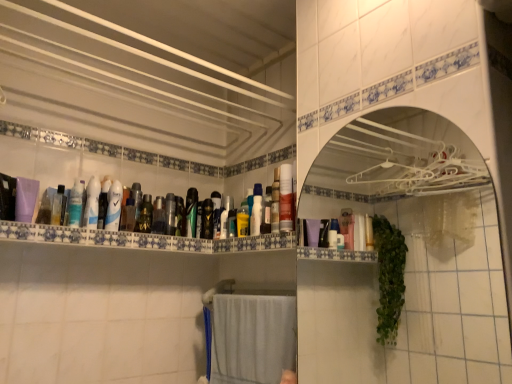
Describe the element at coordinates (252, 338) in the screenshot. Image resolution: width=512 pixels, height=384 pixels. I see `white fabric bath towel at lower center` at that location.

Measure the distance between point (33, 233) and camera.

Point (33, 233) is 4.55 feet away from camera.

What do you see at coordinates (207, 219) in the screenshot? I see `metallic green mouthwash at center, the fourth mouthwash when ordered from right to left` at bounding box center [207, 219].

What do you see at coordinates (286, 199) in the screenshot?
I see `matte plastic mouthwash at center, the first mouthwash viewed from the right` at bounding box center [286, 199].

How much space does green matte bottle at center, which appears as the 6th mouthwash when viewed from the left, occupy vertically?

green matte bottle at center, which appears as the 6th mouthwash when viewed from the left, is 6.80 inches tall.

Identify the location of white fabric bath towel at lower center. (252, 338).

Is blue glossy mouthwash at upper left, which is the thirteenth mouthwash in right-to-left order, outside of metallic green mouthwash at center, marked as the 11th mouthwash in a left-to-right arrangement?

blue glossy mouthwash at upper left, which is the thirteenth mouthwash in right-to-left order, is positioned outside metallic green mouthwash at center, marked as the 11th mouthwash in a left-to-right arrangement.

Considering the relative sizes of blue glossy mouthwash at upper left, which is the thirteenth mouthwash in right-to-left order, and metallic green mouthwash at center, the fourth mouthwash when ordered from right to left, in the image provided, is blue glossy mouthwash at upper left, which is the thirteenth mouthwash in right-to-left order, smaller than metallic green mouthwash at center, the fourth mouthwash when ordered from right to left,?

No.

Which is nearer, (83, 194) or (206, 224)?

Positioned in front is point (83, 194).

Considering the sizes of objects blue glossy mouthwash at upper left, placed as the second mouthwash when sorted from left to right, and metallic green mouthwash at center, the fourth mouthwash when ordered from right to left, in the image provided, who is wider, blue glossy mouthwash at upper left, placed as the second mouthwash when sorted from left to right, or metallic green mouthwash at center, the fourth mouthwash when ordered from right to left,?

metallic green mouthwash at center, the fourth mouthwash when ordered from right to left.

Can you confirm if metallic green mouthwash at center, marked as the 11th mouthwash in a left-to-right arrangement, is bigger than green matte bottle at center, which appears as the 6th mouthwash when viewed from the left?

Incorrect, metallic green mouthwash at center, marked as the 11th mouthwash in a left-to-right arrangement, is not larger than green matte bottle at center, which appears as the 6th mouthwash when viewed from the left.

Is point (201, 220) positioned before point (140, 210)?

No.

In the scene shown: Between metallic green mouthwash at center, marked as the 11th mouthwash in a left-to-right arrangement, and green matte bottle at center, which appears as the 6th mouthwash when viewed from the left, which one has less height?

Standing shorter between the two is metallic green mouthwash at center, marked as the 11th mouthwash in a left-to-right arrangement.

From the image's perspective, is metallic green mouthwash at center, marked as the 11th mouthwash in a left-to-right arrangement, located above or below green matte bottle at center, which appears as the 6th mouthwash when viewed from the left?

Clearly, from the image's perspective, metallic green mouthwash at center, marked as the 11th mouthwash in a left-to-right arrangement, is below green matte bottle at center, which appears as the 6th mouthwash when viewed from the left.

From the image's perspective, is translucent plastic mouthwash at center, which is the fifth mouthwash in left-to-right order, over white fabric bath towel at lower center?

Yes.

Does translucent plastic mouthwash at center, which is the fifth mouthwash in left-to-right order, contain white fabric bath towel at lower center?

No, white fabric bath towel at lower center is not inside translucent plastic mouthwash at center, which is the fifth mouthwash in left-to-right order.

Is translucent plastic mouthwash at center, which is the fifth mouthwash in left-to-right order, placed right next to white fabric bath towel at lower center?

No.

Which is correct: translucent plastic mouthwash at center, which is the fifth mouthwash in left-to-right order, is inside matte plastic mouthwash at center, the first mouthwash viewed from the right, or outside of it?

translucent plastic mouthwash at center, which is the fifth mouthwash in left-to-right order, cannot be found inside matte plastic mouthwash at center, the first mouthwash viewed from the right.

Which of these two, translucent plastic mouthwash at center, arranged as the tenth mouthwash when viewed from the right, or matte plastic mouthwash at center, the 14th mouthwash positioned from the left, stands taller?

matte plastic mouthwash at center, the 14th mouthwash positioned from the left, is taller.

Is matte plastic mouthwash at center, the first mouthwash viewed from the right, at the back of translucent plastic mouthwash at center, arranged as the tenth mouthwash when viewed from the right?

That's not correct — translucent plastic mouthwash at center, arranged as the tenth mouthwash when viewed from the right, is not looking away from matte plastic mouthwash at center, the first mouthwash viewed from the right.

Could you measure the distance between translucent plastic mouthwash at upper left, the 14th mouthwash viewed from the right, and matte plastic spray can at center?

Result: translucent plastic mouthwash at upper left, the 14th mouthwash viewed from the right, is 23.58 inches from matte plastic spray can at center.

Which mouthwash is the 12th one when counting from the left side of the matte plastic spray can at center? Please provide its 2D coordinates.

[(58, 206)]

Considering the points (55, 217) and (223, 217), which point is behind, point (55, 217) or point (223, 217)?

The point (223, 217) is more distant.

From the image's perspective, which object appears higher, translucent plastic mouthwash at upper left, the 14th mouthwash viewed from the right, or matte plastic spray can at center?

translucent plastic mouthwash at upper left, the 14th mouthwash viewed from the right, is shown above in the image.

Considering the points (131, 220) and (79, 208), which point is behind, point (131, 220) or point (79, 208)?

Positioned behind is point (131, 220).

Would you say translucent plastic mouthwash at center, arranged as the tenth mouthwash when viewed from the right, is inside or outside blue glossy mouthwash at upper left, which is the thirteenth mouthwash in right-to-left order?

The correct answer is: outside.

From a real-world perspective, between translucent plastic mouthwash at center, which is the fifth mouthwash in left-to-right order, and blue glossy mouthwash at upper left, placed as the second mouthwash when sorted from left to right, who is vertically higher?

blue glossy mouthwash at upper left, placed as the second mouthwash when sorted from left to right, is physically above.

Which of these two, translucent plastic mouthwash at center, which is the fifth mouthwash in left-to-right order, or blue glossy mouthwash at upper left, placed as the second mouthwash when sorted from left to right, stands shorter?

Standing shorter between the two is translucent plastic mouthwash at center, which is the fifth mouthwash in left-to-right order.

In terms of width, does green matte bottle at center, the ninth mouthwash in the right-to-left sequence, look wider or thinner when compared to blue glossy mouthwash at upper left, which is the thirteenth mouthwash in right-to-left order?

green matte bottle at center, the ninth mouthwash in the right-to-left sequence, is wider than blue glossy mouthwash at upper left, which is the thirteenth mouthwash in right-to-left order.

Is green matte bottle at center, the ninth mouthwash in the right-to-left sequence, aimed at blue glossy mouthwash at upper left, which is the thirteenth mouthwash in right-to-left order?

No.

Which is behind, point (144, 221) or point (81, 198)?

The point (144, 221) is farther from the camera.

This screenshot has width=512, height=384. In order to click on the 8th mouthwash positioned below the blue glossy mouthwash at upper left, which is the thirteenth mouthwash in right-to-left order (from the image's perspective) in this screenshot , I will do `click(207, 219)`.

This screenshot has width=512, height=384. There is a metallic green mouthwash at center, the fourth mouthwash when ordered from right to left. Find the location of `the 4th mouthwash above it (from the image's perspective)`. the 4th mouthwash above it (from the image's perspective) is located at coordinates (145, 214).

Based on their spatial positions, is metallic gold mouthwash at center, positioned as the third mouthwash in right-to-left order, or metallic silver mouthwash at center, the 7th mouthwash viewed from the right, closer to white glossy mouthwash at center, which is the 3th mouthwash in left-to-right order?

Among the two, metallic silver mouthwash at center, the 7th mouthwash viewed from the right, is located nearer to white glossy mouthwash at center, which is the 3th mouthwash in left-to-right order.

Which object lies further to the anchor point metallic green mouthwash at center, the fourth mouthwash when ordered from right to left, green glossy mouthwash at center, which appears as the ninth mouthwash when viewed from the left, or translucent plastic bottles at upper center?

Based on the image, translucent plastic bottles at upper center appears to be further to metallic green mouthwash at center, the fourth mouthwash when ordered from right to left.

Estimate the real-world distances between objects in this image. Which object is closer to yellow matte bottle at center, placed as the thirteenth mouthwash when sorted from left to right, white fabric bath towel at lower center or translucent plastic mouthwash at center, arranged as the tenth mouthwash when viewed from the right?

white fabric bath towel at lower center.

Estimate the real-world distances between objects in this image. Which object is further from matte plastic spray can at center, metallic green mouthwash at center, marked as the 11th mouthwash in a left-to-right arrangement, or metallic gold mouthwash at center, which is the 12th mouthwash in left-to-right order?

metallic green mouthwash at center, marked as the 11th mouthwash in a left-to-right arrangement, lies further to matte plastic spray can at center than the other object.

Estimate the real-world distances between objects in this image. Which object is closer to matte plastic mouthwash at center, the first mouthwash viewed from the right, metallic green mouthwash at center, marked as the 11th mouthwash in a left-to-right arrangement, or translucent plastic mouthwash at center, the 8th mouthwash positioned from the right?

metallic green mouthwash at center, marked as the 11th mouthwash in a left-to-right arrangement, lies closer to matte plastic mouthwash at center, the first mouthwash viewed from the right, than the other object.

Considering their positions, is translucent plastic mouthwash at center, arranged as the seventh mouthwash when viewed from the left, positioned further to translucent plastic mouthwash at center, the 11th mouthwash viewed from the right, than green glossy mouthwash at center, which appears as the ninth mouthwash when viewed from the left?

Based on the image, green glossy mouthwash at center, which appears as the ninth mouthwash when viewed from the left, appears to be further to translucent plastic mouthwash at center, the 11th mouthwash viewed from the right.

Which object lies further to the anchor point metallic silver mouthwash at center, the 7th mouthwash viewed from the right, white glossy mouthwash at center, which ranks as the 12th mouthwash in right-to-left order, or blue glossy mouthwash at upper left, which is the thirteenth mouthwash in right-to-left order?

blue glossy mouthwash at upper left, which is the thirteenth mouthwash in right-to-left order.

When comparing their distances from translucent plastic mouthwash at center, marked as the fourth mouthwash in a left-to-right arrangement, does metallic gold mouthwash at center, positioned as the third mouthwash in right-to-left order, or white glossy medicine cabinet at upper center seem closer?

Based on the image, metallic gold mouthwash at center, positioned as the third mouthwash in right-to-left order, appears to be nearer to translucent plastic mouthwash at center, marked as the fourth mouthwash in a left-to-right arrangement.

I want to click on shelve situated between blue glossy mouthwash at upper left, which is the thirteenth mouthwash in right-to-left order, and white fabric bath towel at lower center from left to right, so click(141, 239).

At what (x,y) coordinates should I click in order to perform the action: click on toiletry located between translucent plastic mouthwash at center, which is the fifth mouthwash in left-to-right order, and yellow matte bottle at center, placed as the thirteenth mouthwash when sorted from left to right, in the left-right direction. Please return your answer as a coordinate pair (x, y). This screenshot has width=512, height=384. Looking at the image, I should click on (225, 215).

Image resolution: width=512 pixels, height=384 pixels. I want to click on shelve located between blue glossy mouthwash at upper left, which is the thirteenth mouthwash in right-to-left order, and white glossy medicine cabinet at upper center in the left-right direction, so click(141, 239).

Locate an element on the screen. bath towel positioned between white glossy medicine cabinet at upper center and yellow matte bottle at center, placed as the thirteenth mouthwash when sorted from left to right, from near to far is located at coordinates (252, 338).